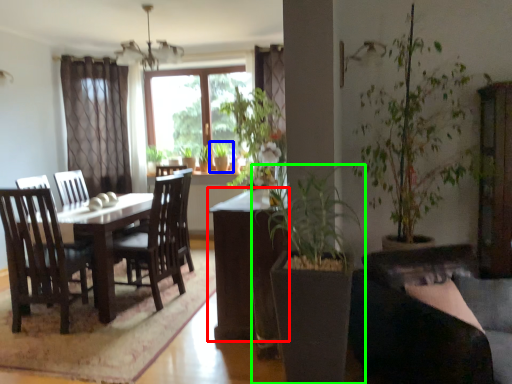
Question: Based on their relative distances, which object is farther from table (highlighted by a red box)? Choose from houseplant (highlighted by a blue box) and houseplant (highlighted by a green box).

Choices:
 (A) houseplant
 (B) houseplant

Answer: (A)